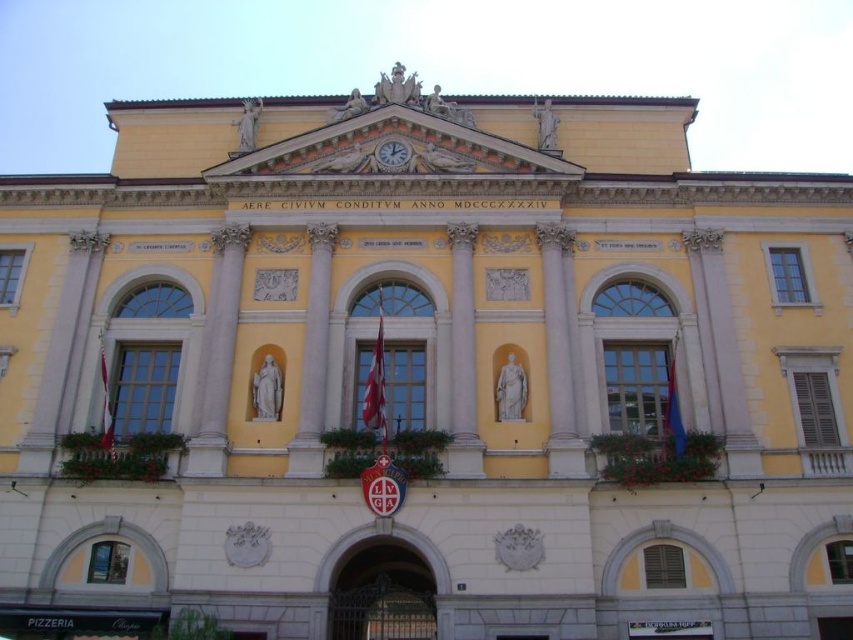
Question: Which object is farther from the camera taking this photo?

Choices:
 (A) white marble pillar at center
 (B) white marble statue at center

Answer: (A)

Question: Which of the following is the farthest from the observer?

Choices:
 (A) white marble column at center
 (B) white marble pillar at center

Answer: (B)

Question: Does white marble statue at center appear over gold metallic clock at upper center?

Choices:
 (A) yes
 (B) no

Answer: (B)

Question: Is white marble column at center closer to the viewer compared to gold metallic clock at upper center?

Choices:
 (A) no
 (B) yes

Answer: (B)

Question: Is white marble statue at center above gold metallic clock at upper center?

Choices:
 (A) yes
 (B) no

Answer: (B)

Question: Which of the following is the farthest from the observer?

Choices:
 (A) white marble pillar at center
 (B) gold metallic clock at upper center

Answer: (B)